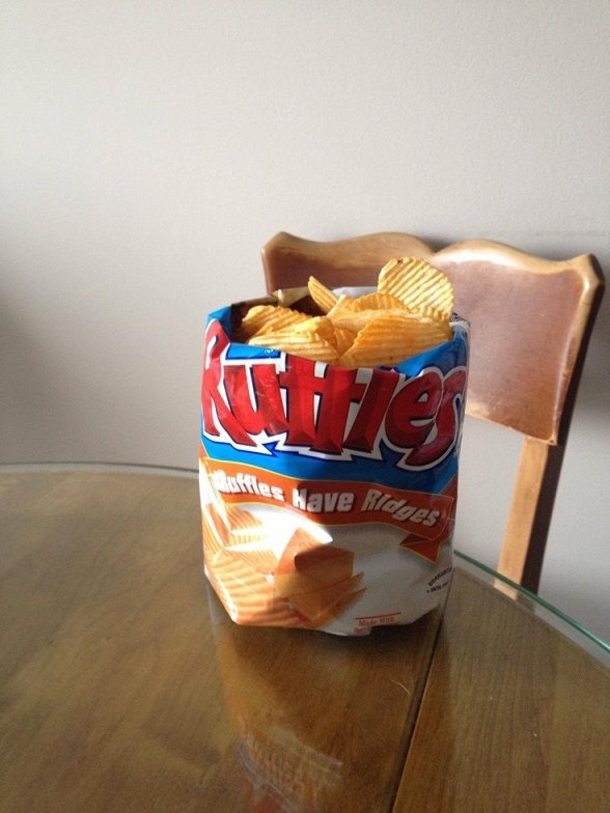
This screenshot has height=813, width=610. Find the location of `glass table cover`. glass table cover is located at coordinates (493, 590).